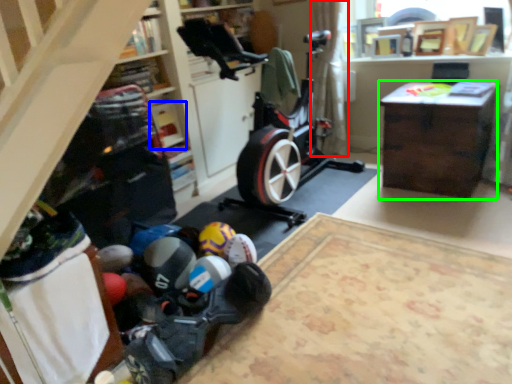
Question: Which object is the closest to the curtain (highlighted by a red box)? Choose among these: shelf (highlighted by a blue box) or desk (highlighted by a green box).

Choices:
 (A) shelf
 (B) desk

Answer: (B)